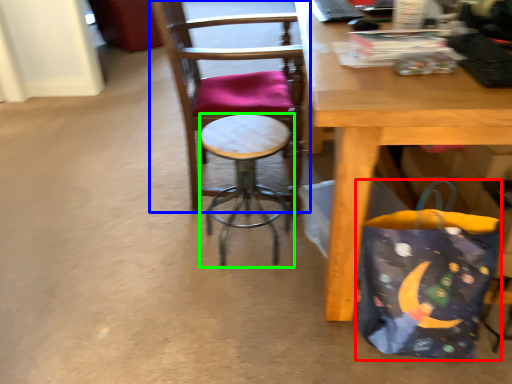
Question: Which object is the closest to the grocery bag (highlighted by a red box)? Choose among these: chair (highlighted by a blue box) or stool (highlighted by a green box).

Choices:
 (A) chair
 (B) stool

Answer: (B)